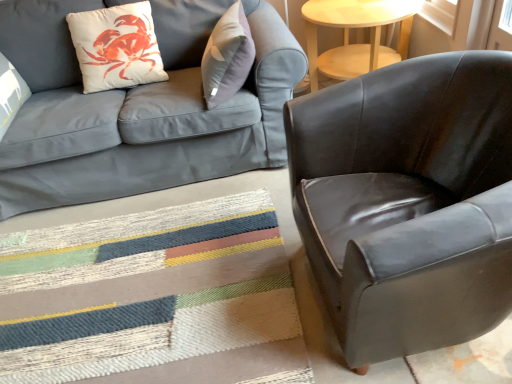
What do you see at coordinates (153, 299) in the screenshot?
I see `textured woven mat at lower center` at bounding box center [153, 299].

Image resolution: width=512 pixels, height=384 pixels. Find the location of `white matte throw pillow at upper left`. white matte throw pillow at upper left is located at coordinates (116, 47).

The height and width of the screenshot is (384, 512). What are the coordinates of `glossy leather armchair at right` in the screenshot? It's located at (408, 201).

From the image's perspective, is light wood round table at upper right below matte gray fabric couch at upper left?

Incorrect, from the image's perspective, light wood round table at upper right is higher than matte gray fabric couch at upper left.

Is point (348, 56) in front of point (61, 125)?

No, it is not.

Is light wood round table at upper right oriented away from matte gray fabric couch at upper left?

light wood round table at upper right is not turned away from matte gray fabric couch at upper left.

Looking at this image, based on their sizes in the image, would you say light wood round table at upper right is bigger or smaller than matte gray fabric couch at upper left?

In the image, light wood round table at upper right appears to be smaller than matte gray fabric couch at upper left.

Identify the location of studio couch to the left of white matte throw pillow at upper left. The width and height of the screenshot is (512, 384). (137, 109).

Considering the points (208, 177) and (109, 53), which point is in front, point (208, 177) or point (109, 53)?

The point (109, 53) is closer to the camera.

From a real-world perspective, is matte gray fabric couch at upper left physically below white matte throw pillow at upper left?

Yes, from a real-world perspective, matte gray fabric couch at upper left is under white matte throw pillow at upper left.

Is matte gray fabric couch at upper left located within white matte throw pillow at upper left?

No, matte gray fabric couch at upper left is located outside of white matte throw pillow at upper left.

Are white matte throw pillow at upper left and matte gray fabric couch at upper left far apart?

white matte throw pillow at upper left is actually quite close to matte gray fabric couch at upper left.

Consider the image. Is the position of white matte throw pillow at upper left less distant than that of matte gray fabric couch at upper left?

No, it is behind matte gray fabric couch at upper left.

Considering the relative sizes of white matte throw pillow at upper left and matte gray fabric couch at upper left in the image provided, is white matte throw pillow at upper left wider than matte gray fabric couch at upper left?

No.

Can you tell me how much textured woven mat at lower center and light wood round table at upper right differ in facing direction?

180 degrees.

From a real-world perspective, is textured woven mat at lower center under light wood round table at upper right?

Indeed, from a real-world perspective, textured woven mat at lower center is positioned beneath light wood round table at upper right.

Consider the image. Is textured woven mat at lower center thinner than light wood round table at upper right?

No, textured woven mat at lower center is not thinner than light wood round table at upper right.

Would you say white matte throw pillow at upper left is a long distance from textured woven mat at lower center?

Yes, white matte throw pillow at upper left and textured woven mat at lower center are quite far apart.

Considering the relative positions of white matte throw pillow at upper left and textured woven mat at lower center in the image provided, is white matte throw pillow at upper left to the left of textured woven mat at lower center from the viewer's perspective?

Yes.

Measure the distance between white matte throw pillow at upper left and textured woven mat at lower center.

white matte throw pillow at upper left and textured woven mat at lower center are 3.42 feet apart.

Who is shorter, light wood round table at upper right or glossy leather armchair at right?

Standing shorter between the two is light wood round table at upper right.

Is point (332, 16) farther from camera compared to point (495, 230)?

Yes, point (332, 16) is behind point (495, 230).

How many degrees apart are the facing directions of light wood round table at upper right and glossy leather armchair at right?

91.7 degrees.

Which object is closer to the camera taking this photo, light wood round table at upper right or glossy leather armchair at right?

glossy leather armchair at right.

Looking at this image, is glossy leather armchair at right taller than white matte throw pillow at upper left?

Correct, glossy leather armchair at right is much taller as white matte throw pillow at upper left.

From a real-world perspective, which object stands above the other?

From a 3D spatial view, white matte throw pillow at upper left is above.

Identify the location of throw pillow lying on the left of glossy leather armchair at right. pos(116,47).

How many degrees apart are the facing directions of glossy leather armchair at right and white matte throw pillow at upper left?

glossy leather armchair at right and white matte throw pillow at upper left are facing 93.6 degrees away from each other.

Identify the location of studio couch that appears on the left of light wood round table at upper right. This screenshot has height=384, width=512. (137, 109).

The width and height of the screenshot is (512, 384). I want to click on studio couch below the white matte throw pillow at upper left (from the image's perspective), so click(x=137, y=109).

From the picture: Estimate the real-world distances between objects in this image. Which object is further from white matte throw pillow at upper left, light wood round table at upper right or textured woven mat at lower center?

Based on the image, textured woven mat at lower center appears to be further to white matte throw pillow at upper left.

Which object lies nearer to the anchor point matte gray fabric couch at upper left, textured woven mat at lower center or glossy leather armchair at right?

Among the two, textured woven mat at lower center is located nearer to matte gray fabric couch at upper left.

Looking at the image, which one is located closer to matte gray fabric couch at upper left, light wood round table at upper right or glossy leather armchair at right?

light wood round table at upper right lies closer to matte gray fabric couch at upper left than the other object.

Based on their spatial positions, is white matte throw pillow at upper left or textured woven mat at lower center closer to light wood round table at upper right?

The object closer to light wood round table at upper right is white matte throw pillow at upper left.

From the image, which object appears to be nearer to white matte throw pillow at upper left, light wood round table at upper right or glossy leather armchair at right?

light wood round table at upper right lies closer to white matte throw pillow at upper left than the other object.

In the scene shown: Considering their positions, is textured woven mat at lower center positioned further to light wood round table at upper right than glossy leather armchair at right?

The object further to light wood round table at upper right is textured woven mat at lower center.

Which object lies further to the anchor point glossy leather armchair at right, light wood round table at upper right or white matte throw pillow at upper left?

white matte throw pillow at upper left is further to glossy leather armchair at right.

Estimate the real-world distances between objects in this image. Which object is further from light wood round table at upper right, white matte throw pillow at upper left or glossy leather armchair at right?

The object further to light wood round table at upper right is glossy leather armchair at right.

You are a GUI agent. You are given a task and a screenshot of the screen. Output one action in this format:
    pyautogui.click(x=<x>, y=<y>)
    Task: Click on the chair situated between matte gray fabric couch at upper left and light wood round table at upper right from left to right
    Image resolution: width=512 pixels, height=384 pixels.
    Given the screenshot: What is the action you would take?
    pyautogui.click(x=408, y=201)

At what (x,y) coordinates should I click in order to perform the action: click on chair between light wood round table at upper right and textured woven mat at lower center in the up-down direction. Please return your answer as a coordinate pair (x, y). Looking at the image, I should click on (408, 201).

Where is `throw pillow located between matte gray fabric couch at upper left and glossy leather armchair at right in the left-right direction`? This screenshot has width=512, height=384. throw pillow located between matte gray fabric couch at upper left and glossy leather armchair at right in the left-right direction is located at coordinates (116, 47).

Image resolution: width=512 pixels, height=384 pixels. I want to click on studio couch between white matte throw pillow at upper left and textured woven mat at lower center in the vertical direction, so 137,109.